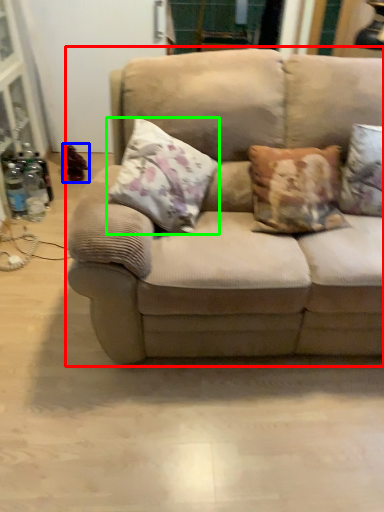
Question: Which object is the closest to the studio couch (highlighted by a red box)? Choose among these: toy (highlighted by a blue box) or pillow (highlighted by a green box).

Choices:
 (A) toy
 (B) pillow

Answer: (B)